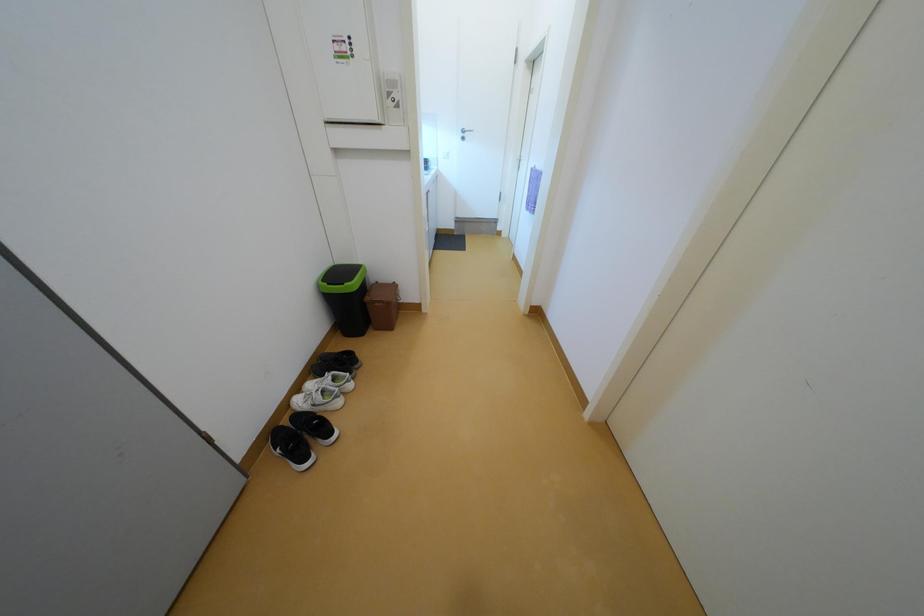
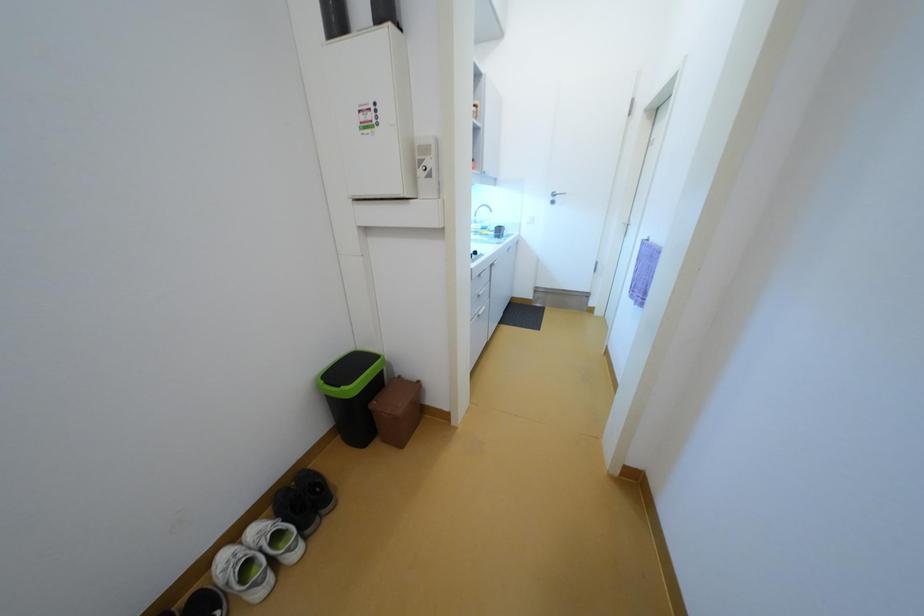
Question: The camera is either moving clockwise (left) or counter-clockwise (right) around the object. The first image is from the beginning of the video and the second image is from the end. Is the camera moving left or right when shooting the video?

Choices:
 (A) Left
 (B) Right

Answer: (B)